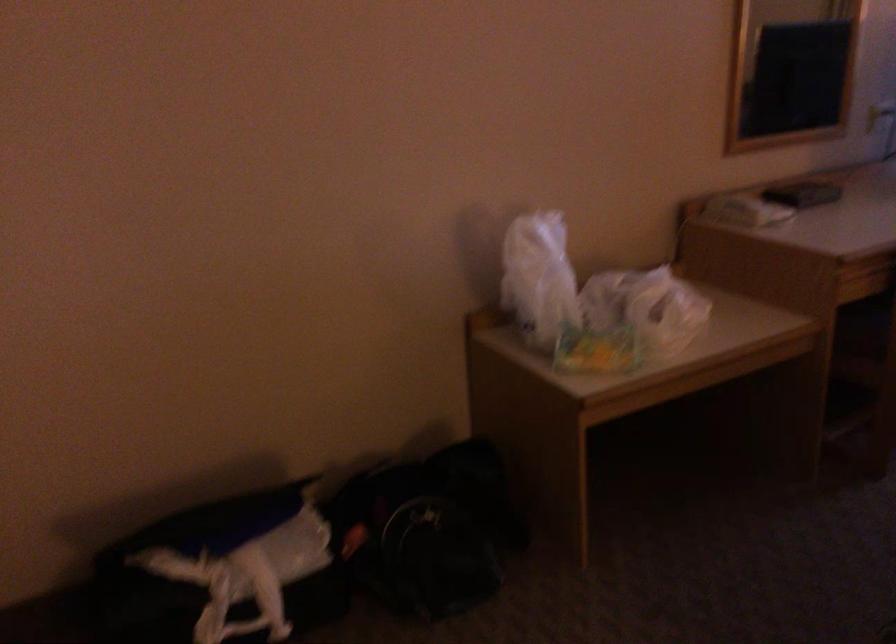
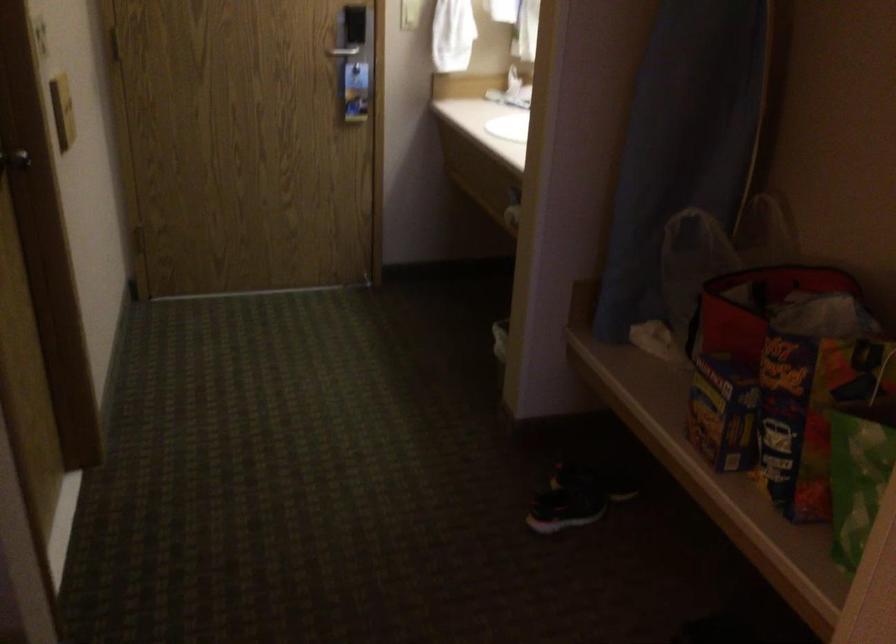
Based on the continuous images, in which direction is the camera rotating?

The rotation direction of the camera is left-down.